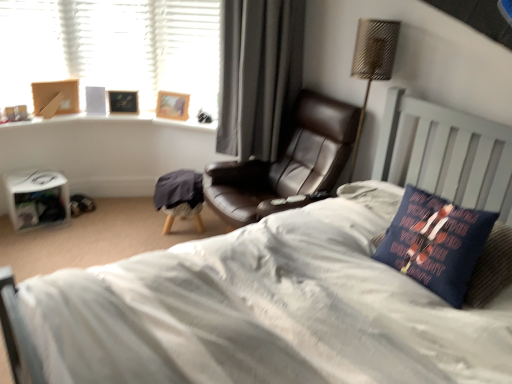
The width and height of the screenshot is (512, 384). Describe the element at coordinates (444, 248) in the screenshot. I see `dark blue fabric pillow at right` at that location.

What is the approximate width of dark blue fabric pillow at right?

The width of dark blue fabric pillow at right is 8.65 inches.

This screenshot has width=512, height=384. What are the coordinates of `wooden picture frame at upper left, the 1th picture frame when ordered from left to right` in the screenshot? It's located at (123, 102).

This screenshot has width=512, height=384. What do you see at coordinates (172, 105) in the screenshot?
I see `wooden picture frame at upper left, the second picture frame in the left-to-right sequence` at bounding box center [172, 105].

Describe the element at coordinates (287, 162) in the screenshot. Image resolution: width=512 pixels, height=384 pixels. I see `leather at center` at that location.

In order to click on dark blue fabric pillow at right in this screenshot , I will do `click(444, 248)`.

Is wooden picture frame at upper left, the second picture frame in the left-to-right sequence, to the left or to the right of black leather chair at center in the image?

wooden picture frame at upper left, the second picture frame in the left-to-right sequence, is to the left of black leather chair at center.

Consider the image. Would you say wooden picture frame at upper left, the second picture frame in the left-to-right sequence, is inside or outside black leather chair at center?

wooden picture frame at upper left, the second picture frame in the left-to-right sequence, is located beyond the bounds of black leather chair at center.

Is black leather chair at center at the back of wooden picture frame at upper left, marked as the first picture frame in a right-to-left arrangement?

No.

Between point (177, 103) and point (256, 72), which one is positioned in front?

The point (256, 72) is more forward.

From the picture: Is the surface of white matte book at lower left in direct contact with black leather chair at center?

No, white matte book at lower left is not touching black leather chair at center.

Would you say white matte book at lower left is outside black leather chair at center?

Absolutely, white matte book at lower left is external to black leather chair at center.

What are the coordinates of `paperback book that appears on the left of black leather chair at center` in the screenshot? It's located at (37, 198).

Is white matte book at lower left bigger than black leather chair at center?

Incorrect, white matte book at lower left is not larger than black leather chair at center.

I want to click on paperback book located above the dark blue fabric pillow at right (from the image's perspective), so click(37, 198).

Between point (15, 188) and point (477, 274), which one is positioned behind?

The point (15, 188) is more distant.

Is white matte book at lower left smaller than dark blue fabric pillow at right?

No.

Based on the photo, considering the sizes of objects white matte book at lower left and dark blue fabric pillow at right in the image provided, who is thinner, white matte book at lower left or dark blue fabric pillow at right?

With smaller width is dark blue fabric pillow at right.

Looking at their sizes, would you say wooden picture frame at upper left, marked as the first picture frame in a right-to-left arrangement, is wider or thinner than leather at center?

Clearly, wooden picture frame at upper left, marked as the first picture frame in a right-to-left arrangement, has less width compared to leather at center.

Is wooden picture frame at upper left, marked as the first picture frame in a right-to-left arrangement, positioned with its back to leather at center?

No, wooden picture frame at upper left, marked as the first picture frame in a right-to-left arrangement, is not facing the opposite direction of leather at center.

Image resolution: width=512 pixels, height=384 pixels. Find the location of `chair located in front of the wooden picture frame at upper left, marked as the first picture frame in a right-to-left arrangement`. chair located in front of the wooden picture frame at upper left, marked as the first picture frame in a right-to-left arrangement is located at coordinates (287, 162).

Which object is more forward, wooden picture frame at upper left, the second picture frame in the left-to-right sequence, or leather at center?

leather at center is more forward.

The width and height of the screenshot is (512, 384). What are the coordinates of `table lamp lying above the white matte book at lower left (from the image's perspective)` in the screenshot? It's located at coord(372,62).

Between metallic woven table lamp at upper right and white matte book at lower left, which one is positioned behind?

Positioned behind is white matte book at lower left.

Based on the photo, can you confirm if metallic woven table lamp at upper right is shorter than white matte book at lower left?

Incorrect, the height of metallic woven table lamp at upper right does not fall short of that of white matte book at lower left.

Is point (371, 79) farther from camera compared to point (55, 195)?

No.

In the image, is dark blue fabric pillow at right on the left side or the right side of leather at center?

Based on their positions, dark blue fabric pillow at right is located to the right of leather at center.

Considering the positions of point (454, 249) and point (238, 206), is point (454, 249) closer or farther from the camera than point (238, 206)?

Point (454, 249) appears to be closer to the viewer than point (238, 206).

Considering the sizes of objects dark blue fabric pillow at right and leather at center in the image provided, who is shorter, dark blue fabric pillow at right or leather at center?

dark blue fabric pillow at right.

Considering the sizes of objects dark blue fabric pillow at right and leather at center in the image provided, who is bigger, dark blue fabric pillow at right or leather at center?

Bigger between the two is leather at center.

Based on the photo, from the image's perspective, is leather at center on top of white matte book at lower left?

Result: Yes.

Considering the sizes of objects leather at center and white matte book at lower left in the image provided, who is bigger, leather at center or white matte book at lower left?

With larger size is leather at center.

Is leather at center wider or thinner than white matte book at lower left?

In the image, leather at center appears to be wider than white matte book at lower left.

You are a GUI agent. You are given a task and a screenshot of the screen. Output one action in this format:
    pyautogui.click(x=<x>, y=<y>)
    Task: Click on the curtain located on the right of wooden picture frame at upper left, marked as the first picture frame in a right-to-left arrangement
    The width and height of the screenshot is (512, 384).
    Given the screenshot: What is the action you would take?
    pyautogui.click(x=258, y=74)

You are a GUI agent. You are given a task and a screenshot of the screen. Output one action in this format:
    pyautogui.click(x=<x>, y=<y>)
    Task: Click on the paperback book located underneath the black leather chair at center (from a real-world perspective)
    
    Given the screenshot: What is the action you would take?
    pyautogui.click(x=37, y=198)

From the image, which object appears to be farther from leather at center, wooden picture frame at upper left, the 1th picture frame when ordered from left to right, or wooden picture frame at upper left, the second picture frame in the left-to-right sequence?

Based on the image, wooden picture frame at upper left, the 1th picture frame when ordered from left to right, appears to be further to leather at center.

When comparing their distances from wooden picture frame at upper left, marked as the first picture frame in a right-to-left arrangement, does metallic woven table lamp at upper right or wooden picture frame at upper left, acting as the second picture frame starting from the right, seem closer?

wooden picture frame at upper left, acting as the second picture frame starting from the right, lies closer to wooden picture frame at upper left, marked as the first picture frame in a right-to-left arrangement, than the other object.

Based on their spatial positions, is metallic woven table lamp at upper right or wooden picture frame at upper left, acting as the second picture frame starting from the right, further from black leather chair at center?

Among the two, wooden picture frame at upper left, acting as the second picture frame starting from the right, is located further to black leather chair at center.

When comparing their distances from black leather chair at center, does wooden picture frame at upper left, the 1th picture frame when ordered from left to right, or wooden picture frame at upper left, marked as the first picture frame in a right-to-left arrangement, seem closer?

wooden picture frame at upper left, marked as the first picture frame in a right-to-left arrangement.

Estimate the real-world distances between objects in this image. Which object is further from metallic woven table lamp at upper right, dark blue fabric pillow at right or white matte book at lower left?

white matte book at lower left lies further to metallic woven table lamp at upper right than the other object.

When comparing their distances from black leather chair at center, does metallic woven table lamp at upper right or wooden picture frame at upper left, marked as the first picture frame in a right-to-left arrangement, seem further?

Among the two, metallic woven table lamp at upper right is located further to black leather chair at center.

When comparing their distances from white matte book at lower left, does leather at center or dark blue fabric pillow at right seem further?

dark blue fabric pillow at right is positioned further to the anchor white matte book at lower left.

Estimate the real-world distances between objects in this image. Which object is further from black leather chair at center, leather at center or dark blue fabric pillow at right?

The object further to black leather chair at center is dark blue fabric pillow at right.

I want to click on curtain between wooden picture frame at upper left, marked as the first picture frame in a right-to-left arrangement, and metallic woven table lamp at upper right from left to right, so click(x=258, y=74).

Identify the location of chair between dark blue fabric pillow at right and wooden picture frame at upper left, marked as the first picture frame in a right-to-left arrangement, along the z-axis. Image resolution: width=512 pixels, height=384 pixels. (287, 162).

Identify the location of curtain between white matte book at lower left and dark blue fabric pillow at right from left to right. This screenshot has height=384, width=512. (258, 74).

The height and width of the screenshot is (384, 512). Identify the location of curtain between wooden picture frame at upper left, the 1th picture frame when ordered from left to right, and leather at center. (258, 74).